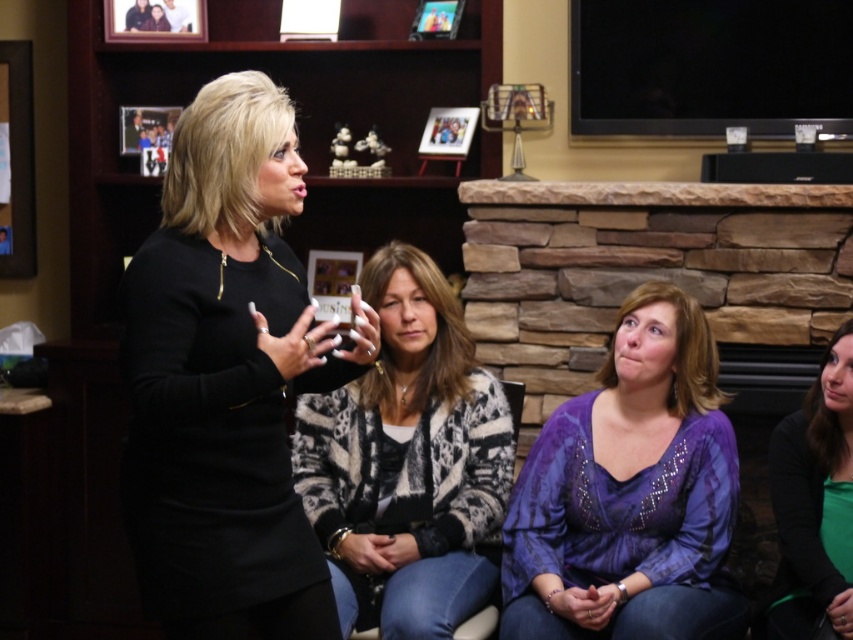
Is black matte dress at center thinner than wooden photo frame at upper left?

No.

This screenshot has height=640, width=853. What are the coordinates of `black matte dress at center` in the screenshot? It's located at (227, 378).

This screenshot has height=640, width=853. I want to click on black matte dress at center, so click(x=227, y=378).

Based on the photo, is printed fabric cardigan at center below wooden picture frame at upper center?

Yes, printed fabric cardigan at center is below wooden picture frame at upper center.

Which is in front, point (474, 513) or point (459, 125)?

Positioned in front is point (474, 513).

The image size is (853, 640). I want to click on printed fabric cardigan at center, so click(408, 461).

Is purple sequined blouse at center behind printed fabric cardigan at center?

No, purple sequined blouse at center is in front of printed fabric cardigan at center.

Is purple sequined blouse at center to the left of printed fabric cardigan at center from the viewer's perspective?

In fact, purple sequined blouse at center is to the right of printed fabric cardigan at center.

Who is more forward, (686, 356) or (399, 536)?

Point (686, 356) is more forward.

Where is `purple sequined blouse at center`? The width and height of the screenshot is (853, 640). purple sequined blouse at center is located at coordinates (630, 493).